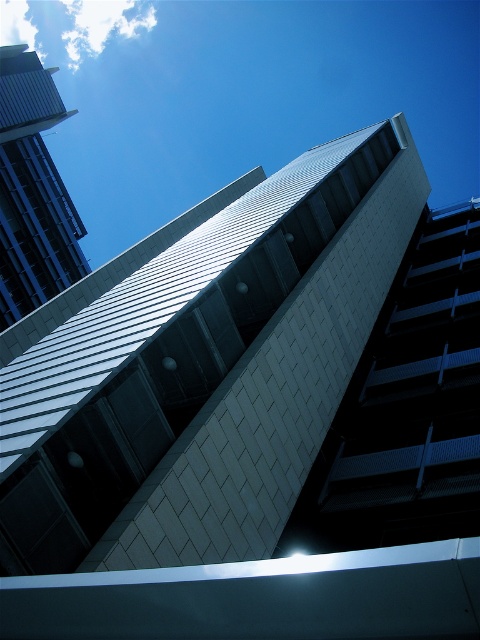
Question: Does metallic silver building at center appear under smooth glass skyscraper at upper left?

Choices:
 (A) no
 (B) yes

Answer: (B)

Question: In this image, where is metallic silver building at center located relative to smooth glass skyscraper at upper left?

Choices:
 (A) below
 (B) above

Answer: (A)

Question: Does metallic silver building at center have a smaller size compared to smooth glass skyscraper at upper left?

Choices:
 (A) no
 (B) yes

Answer: (A)

Question: Among these objects, which one is farthest from the camera?

Choices:
 (A) smooth glass skyscraper at upper left
 (B) metallic silver building at center

Answer: (A)